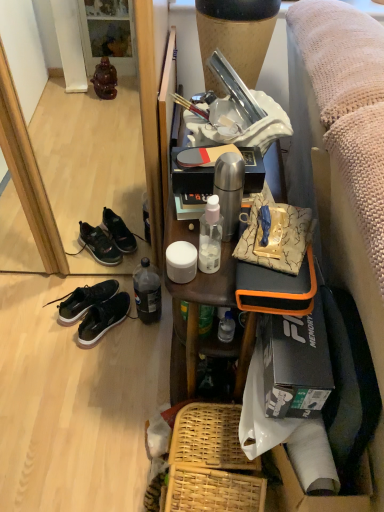
Question: Is wooden table at upper right bigger than black matte sneakers at lower left?

Choices:
 (A) no
 (B) yes

Answer: (B)

Question: Is wooden table at upper right thinner than black matte sneakers at lower left?

Choices:
 (A) yes
 (B) no

Answer: (B)

Question: Is wooden table at upper right closer to the viewer compared to black matte sneakers at lower left?

Choices:
 (A) no
 (B) yes

Answer: (B)

Question: Is wooden table at upper right oriented away from black matte sneakers at lower left?

Choices:
 (A) yes
 (B) no

Answer: (B)

Question: Considering the relative sizes of wooden table at upper right and black matte sneakers at lower left in the image provided, is wooden table at upper right shorter than black matte sneakers at lower left?

Choices:
 (A) yes
 (B) no

Answer: (B)

Question: Is wooden table at upper right directly adjacent to black matte sneakers at lower left?

Choices:
 (A) no
 (B) yes

Answer: (A)

Question: Considering the relative sizes of matte black mirror at lower left and woven wood picnic basket at lower center in the image provided, is matte black mirror at lower left wider than woven wood picnic basket at lower center?

Choices:
 (A) no
 (B) yes

Answer: (B)

Question: Is matte black mirror at lower left outside of woven wood picnic basket at lower center?

Choices:
 (A) no
 (B) yes

Answer: (B)

Question: Does matte black mirror at lower left have a lesser width compared to woven wood picnic basket at lower center?

Choices:
 (A) no
 (B) yes

Answer: (A)

Question: From the image's perspective, is matte black mirror at lower left beneath woven wood picnic basket at lower center?

Choices:
 (A) no
 (B) yes

Answer: (A)

Question: Does matte black mirror at lower left have a smaller size compared to woven wood picnic basket at lower center?

Choices:
 (A) no
 (B) yes

Answer: (A)

Question: Is matte black mirror at lower left positioned in front of woven wood picnic basket at lower center?

Choices:
 (A) no
 (B) yes

Answer: (B)

Question: Does matte black mirror at lower left have a greater height compared to black matte sneakers at lower left?

Choices:
 (A) no
 (B) yes

Answer: (B)